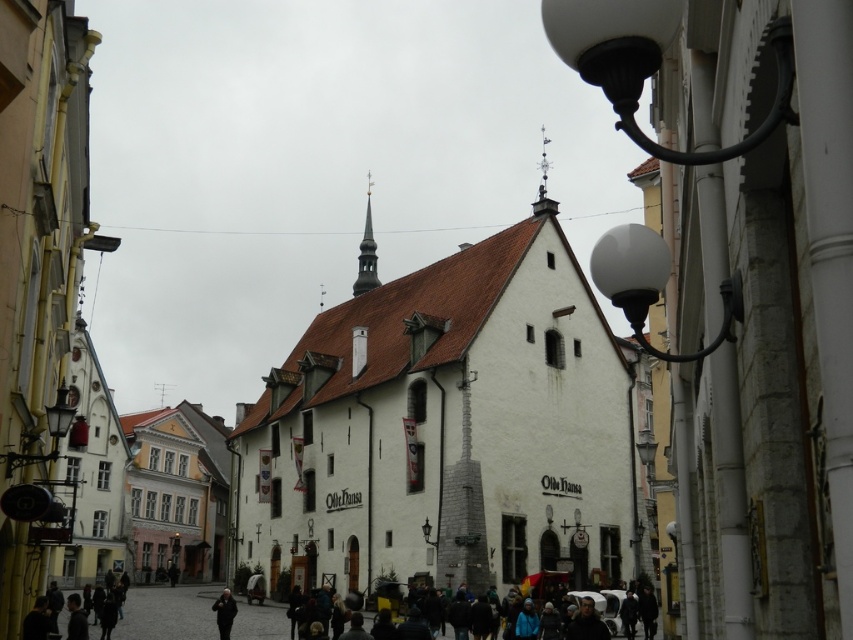
You are a tourist standing on the cobblestone street in front of the Olde Hansa building. You want to take a photo that includes both the white stone church at center and the polished copper spire at center. Which object should you focus on to ensure both are in the frame without zooming in?

You should focus on the white stone church at center because it might be wider than the polished copper spire at center, so capturing its width will likely include the spire as well.

You are an architect planning to install a new lighting system between the white stone church at center and the polished copper spire at center. The lights require a minimum distance of 25 meters between them to function properly. Based on the scene, will the existing spacing between the two structures allow the lights to work correctly?

The white stone church at center and polished copper spire at center are 27.32 meters apart, which exceeds the minimum required distance of 25 meters. Therefore, the lighting system will function properly between them.